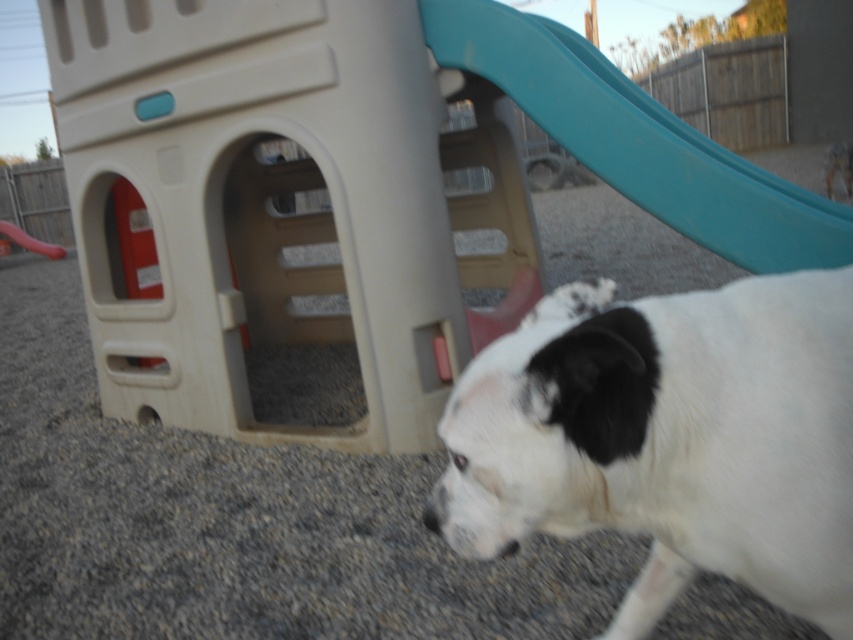
Question: Which point appears farthest from the camera in this image?

Choices:
 (A) (402, 515)
 (B) (621, 140)
 (C) (59, 248)

Answer: (C)

Question: Does rubberized red slide at center appear on the left side of black matte nose at lower center?

Choices:
 (A) yes
 (B) no

Answer: (A)

Question: Does beige plastic playhouse at center appear on the left side of gray gravel at center?

Choices:
 (A) no
 (B) yes

Answer: (B)

Question: Which point is farther from the camera taking this photo?

Choices:
 (A) (601, 157)
 (B) (36, 252)

Answer: (B)

Question: Which of the following is the farthest from the observer?

Choices:
 (A) white fur dog at lower right
 (B) rubberized red slide at center
 (C) beige plastic playhouse at center

Answer: (B)

Question: Is beige plastic playhouse at center thinner than gray gravel at center?

Choices:
 (A) yes
 (B) no

Answer: (A)